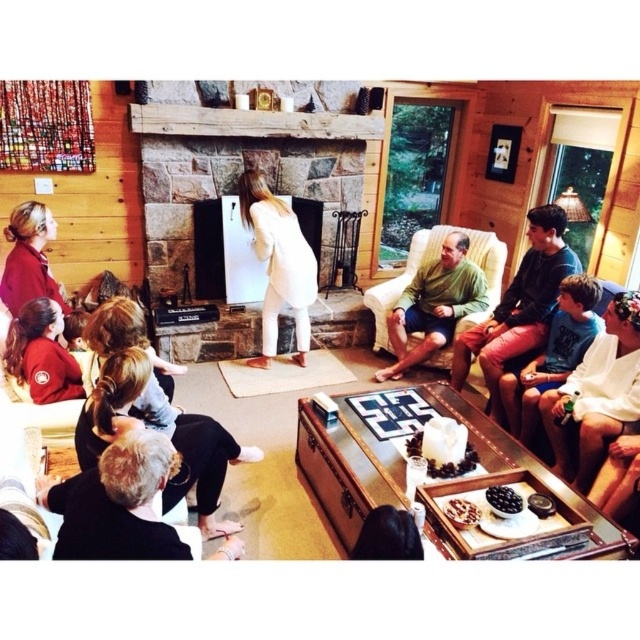
Question: Is matte green shirt at center below matte red jacket at center?

Choices:
 (A) no
 (B) yes

Answer: (A)

Question: Can you confirm if matte green shirt at center is thinner than blonde hair at lower left?

Choices:
 (A) yes
 (B) no

Answer: (B)

Question: Among these objects, which one is nearest to the camera?

Choices:
 (A) matte red jacket at lower left
 (B) green fabric armchair at center

Answer: (A)

Question: Which point appears closest to the camera in this image?

Choices:
 (A) (419, 275)
 (B) (26, 237)
 (C) (589, 385)

Answer: (B)

Question: Which of the following is the farthest from the observer?

Choices:
 (A) (634, 392)
 (B) (51, 385)

Answer: (A)

Question: Can you confirm if white cotton shirt at lower right is bigger than green cotton shirt at center?

Choices:
 (A) yes
 (B) no

Answer: (B)